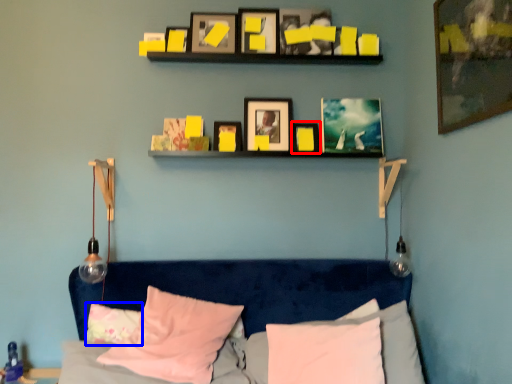
Question: Among these objects, which one is nearest to the camera, picture frame (highlighted by a red box) or pillow (highlighted by a blue box)?

Choices:
 (A) picture frame
 (B) pillow

Answer: (B)